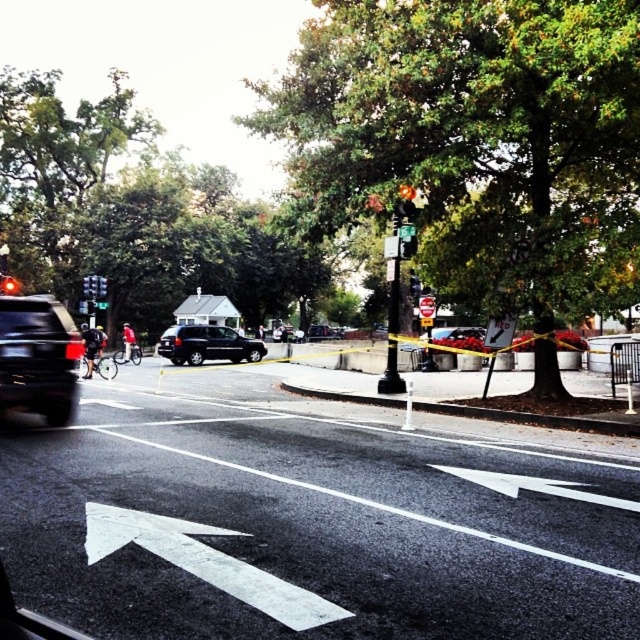
You are a delivery person trying to decide which vehicle to load packages into. The black matte suv at center and the metallic silver car at center are both available. Based on their sizes, which one might have more storage space inside?

The black matte suv at center has a greater height compared to the metallic silver car at center, so it likely has more storage space inside due to its taller design.

You are a pedestrian standing on the sidewalk next to the road. You see a black matte suv at center and a metallic silver car at center. Which vehicle is closer to you?

The black matte suv at center is closer to you because the metallic silver car at center is behind it.

You are a pedestrian crossing the street from the sidewalk on the right. There are two vehicles in your view, the matte black suv at left and the metallic silver car at center. Which vehicle is closer to you as you start crossing?

The matte black suv at left is closer to you because it is positioned over the metallic silver car at center, meaning it is in front and nearer to your starting position on the sidewalk.